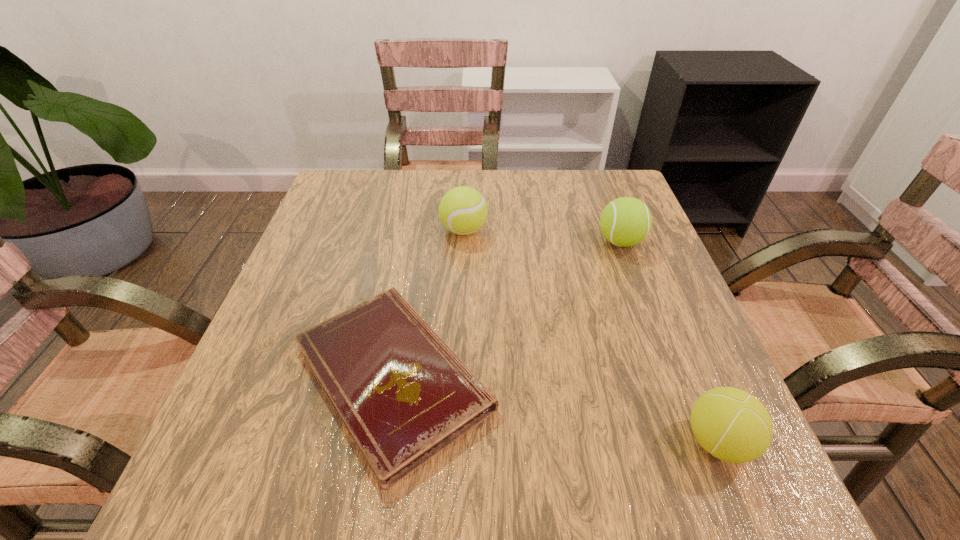
At what (x,y) coordinates should I click in order to perform the action: click on the leftmost tennis ball. Please return your answer as a coordinate pair (x, y). The height and width of the screenshot is (540, 960). Looking at the image, I should click on (463, 210).

Locate an element on the screen. The image size is (960, 540). the nearest tennis ball is located at coordinates tap(734, 426).

Where is `notebook`? This screenshot has height=540, width=960. notebook is located at coordinates (403, 395).

The width and height of the screenshot is (960, 540). I want to click on vacant position located on the right of the leftmost tennis ball, so click(x=645, y=231).

The image size is (960, 540). Identify the location of free location located on the back of the nearest tennis ball. (694, 383).

Locate an element on the screen. The height and width of the screenshot is (540, 960). free space located on the back of the notebook is located at coordinates (417, 238).

Image resolution: width=960 pixels, height=540 pixels. Identify the location of object that is at the far edge. (463, 210).

Find the location of a particular element. Image resolution: width=960 pixels, height=540 pixels. tennis ball at the near edge is located at coordinates (734, 426).

Where is `notebook that is at the near edge`? notebook that is at the near edge is located at coordinates (403, 395).

This screenshot has height=540, width=960. Identify the location of object located at the left edge. (403, 395).